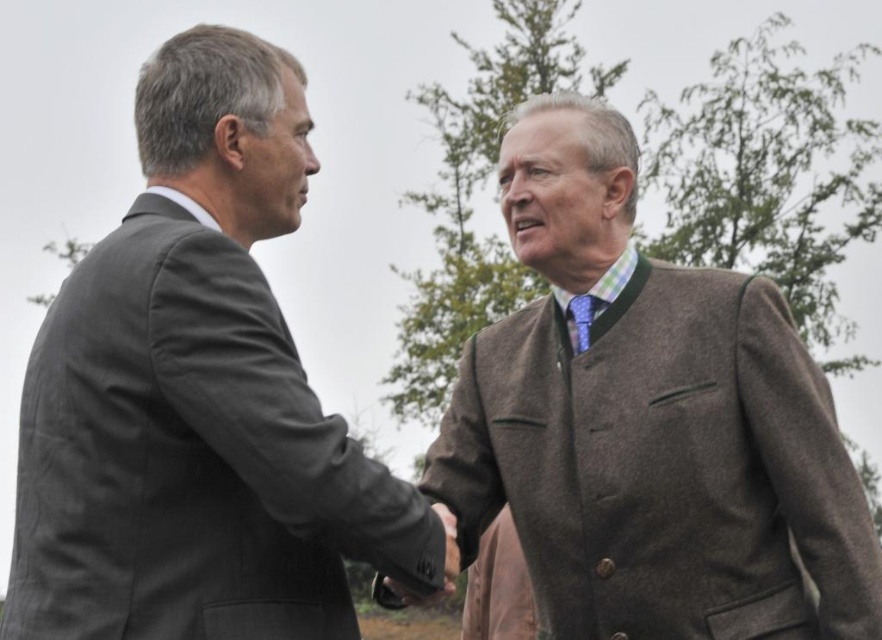
Is dark gray suit at left thinner than smooth leather hand at center?

No, dark gray suit at left is not thinner than smooth leather hand at center.

The image size is (882, 640). I want to click on dark gray suit at left, so click(x=197, y=396).

Image resolution: width=882 pixels, height=640 pixels. Find the location of `dark gray suit at left`. dark gray suit at left is located at coordinates (197, 396).

From the picture: Is dark gray suit at left taller than brown woolen jacket at center?

In fact, dark gray suit at left may be shorter than brown woolen jacket at center.

Between dark gray suit at left and brown woolen jacket at center, which one is positioned higher?

dark gray suit at left

Does point (212, 364) come behind point (703, 516)?

No, (212, 364) is in front of (703, 516).

In order to click on dark gray suit at left in this screenshot , I will do `click(197, 396)`.

Who is more distant from viewer, (763, 276) or (441, 524)?

Positioned behind is point (763, 276).

Consider the image. Does brown woolen jacket at center come behind smooth leather hand at center?

Yes, brown woolen jacket at center is further from the viewer.

Does point (491, 422) come closer to viewer compared to point (452, 552)?

No, (491, 422) is behind (452, 552).

Image resolution: width=882 pixels, height=640 pixels. What are the coordinates of `brown woolen jacket at center` in the screenshot? It's located at point(647,422).